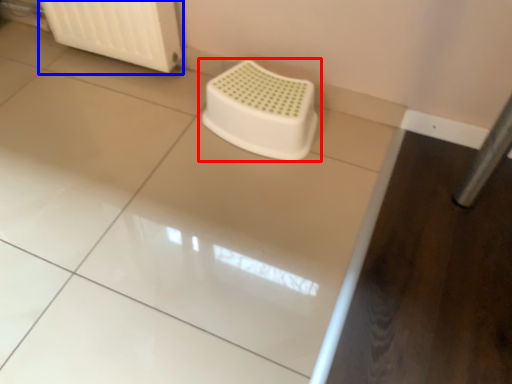
Question: Which object appears farthest to the camera in this image, toilet (highlighted by a red box) or radiator (highlighted by a blue box)?

Choices:
 (A) toilet
 (B) radiator

Answer: (B)